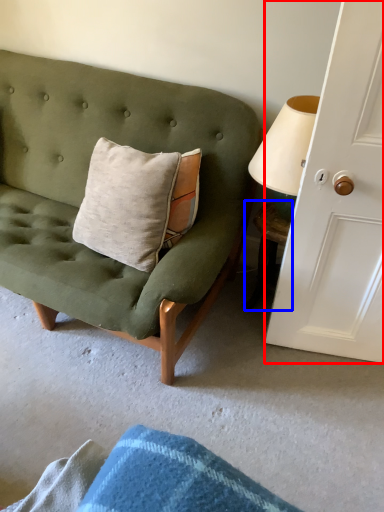
Question: Which object appears closest to the camera in this image, door (highlighted by a red box) or table (highlighted by a blue box)?

Choices:
 (A) door
 (B) table

Answer: (A)